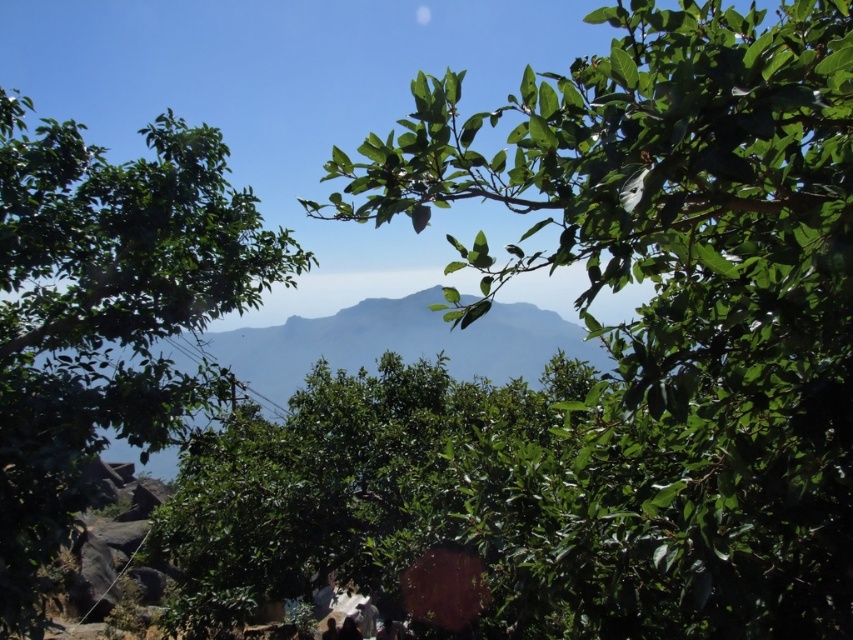
Question: Which point is closer to the camera?

Choices:
 (A) green leafy tree at left
 (B) green leafy branch at upper center

Answer: (B)

Question: Does green leafy branch at upper center have a smaller size compared to green leafy tree at left?

Choices:
 (A) no
 (B) yes

Answer: (B)

Question: Which point is closer to the camera taking this photo?

Choices:
 (A) (49, 330)
 (B) (421, 189)

Answer: (B)

Question: Is green leafy branch at upper center wider than green leafy tree at left?

Choices:
 (A) yes
 (B) no

Answer: (B)

Question: Which object appears closest to the camera in this image?

Choices:
 (A) green leafy branch at upper center
 (B) green leafy tree at left

Answer: (A)

Question: Is green leafy branch at upper center to the right of green leafy tree at left from the viewer's perspective?

Choices:
 (A) no
 (B) yes

Answer: (B)